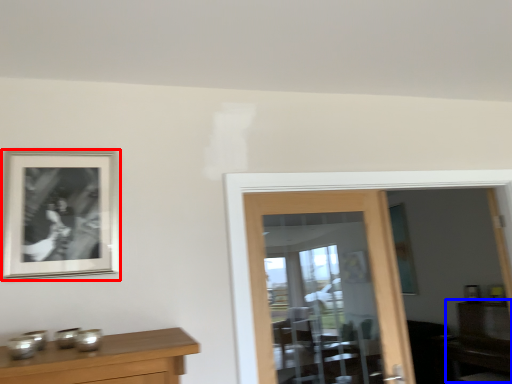
Question: Among these objects, which one is farthest to the camera, picture frame (highlighted by a red box) or dresser (highlighted by a blue box)?

Choices:
 (A) picture frame
 (B) dresser

Answer: (B)